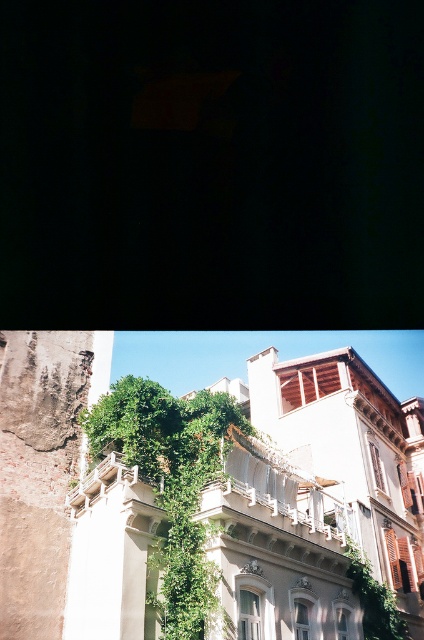
Question: Which of the following is the closest to the observer?

Choices:
 (A) (270, 476)
 (B) (176, 513)

Answer: (B)

Question: Can you confirm if green leafy ivy at center is positioned to the right of white stone balcony at center?

Choices:
 (A) no
 (B) yes

Answer: (A)

Question: Which point appears farthest from the camera in this image?

Choices:
 (A) (134, 468)
 (B) (217, 460)

Answer: (B)

Question: Is green leafy ivy at center below white stone balcony at center?

Choices:
 (A) yes
 (B) no

Answer: (B)

Question: Can you confirm if green leafy ivy at center is positioned to the right of white stone balcony at center?

Choices:
 (A) yes
 (B) no

Answer: (B)

Question: Among these objects, which one is nearest to the camera?

Choices:
 (A) white stone balcony at center
 (B) green leafy ivy at center

Answer: (B)